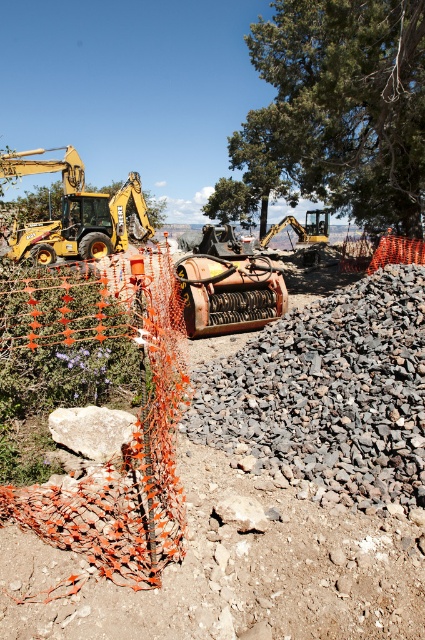
You are a delivery truck driver who needs to drive through the construction site. The truck requires a minimum width of 3 meters to pass safely. Given the gray rough gravel at center and the green leafy tree at center, which object indicates the available width for your truck?

The gray rough gravel at center has a lesser width compared to the green leafy tree at center. Since the gravel is narrower, the available width for the truck would be determined by the gravel. If the gravel is less than 3 meters wide, the truck cannot pass safely.

You are an inspector at the construction site. You need to check both the yellow rubber excavator at upper left and the yellow metal excavator at left. Which one is located lower in the image?

The yellow rubber excavator at upper left is located below the yellow metal excavator at left, so it is positioned lower in the image.